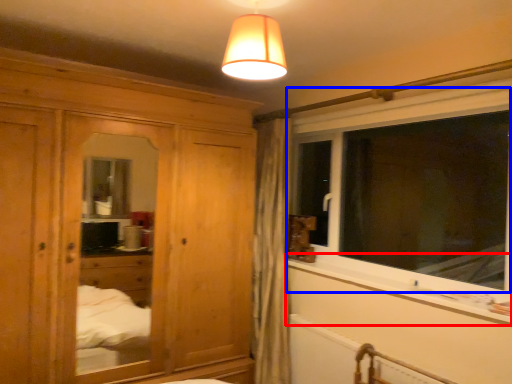
Question: Which of the following is the closest to the observer, window sill (highlighted by a red box) or window (highlighted by a blue box)?

Choices:
 (A) window sill
 (B) window

Answer: (A)